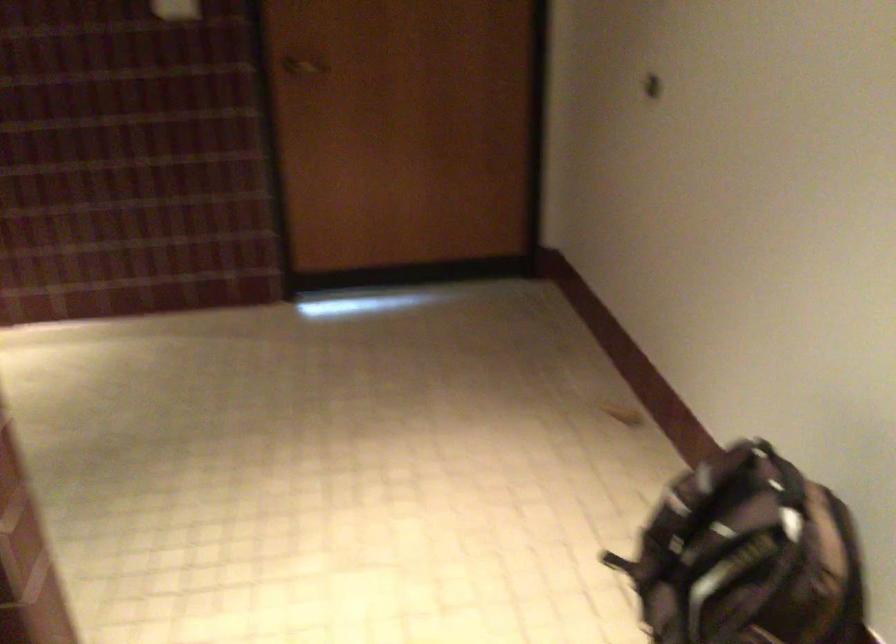
Where would you turn the door handle? Please return your answer as a coordinate pair (x, y).

(304, 66)